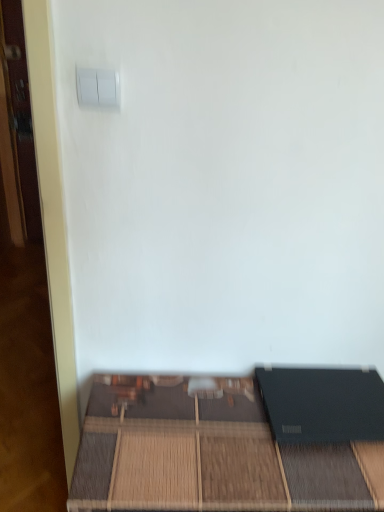
Question: Is white plastic light switch at upper left facing towards matte black laptop at lower right?

Choices:
 (A) no
 (B) yes

Answer: (A)

Question: Can you confirm if white plastic light switch at upper left is wider than matte black laptop at lower right?

Choices:
 (A) yes
 (B) no

Answer: (B)

Question: Considering the relative sizes of white plastic light switch at upper left and matte black laptop at lower right in the image provided, is white plastic light switch at upper left taller than matte black laptop at lower right?

Choices:
 (A) yes
 (B) no

Answer: (B)

Question: Is white plastic light switch at upper left positioned with its back to matte black laptop at lower right?

Choices:
 (A) no
 (B) yes

Answer: (A)

Question: From a real-world perspective, is white plastic light switch at upper left on matte black laptop at lower right?

Choices:
 (A) no
 (B) yes

Answer: (B)

Question: Is the depth of white plastic light switch at upper left greater than that of matte black laptop at lower right?

Choices:
 (A) yes
 (B) no

Answer: (B)

Question: From the image's perspective, is matte black laptop at lower right under white plastic light switch at upper left?

Choices:
 (A) yes
 (B) no

Answer: (A)

Question: Is matte black laptop at lower right completely or partially outside of white plastic light switch at upper left?

Choices:
 (A) yes
 (B) no

Answer: (A)

Question: Is white plastic light switch at upper left inside matte black laptop at lower right?

Choices:
 (A) no
 (B) yes

Answer: (A)

Question: Is matte black laptop at lower right aimed at white plastic light switch at upper left?

Choices:
 (A) yes
 (B) no

Answer: (B)

Question: Is matte black laptop at lower right to the right of white plastic light switch at upper left from the viewer's perspective?

Choices:
 (A) yes
 (B) no

Answer: (A)

Question: Is matte black laptop at lower right thinner than white plastic light switch at upper left?

Choices:
 (A) yes
 (B) no

Answer: (B)

Question: From the image's perspective, is matte black laptop at lower right located above or below white plastic light switch at upper left?

Choices:
 (A) above
 (B) below

Answer: (B)